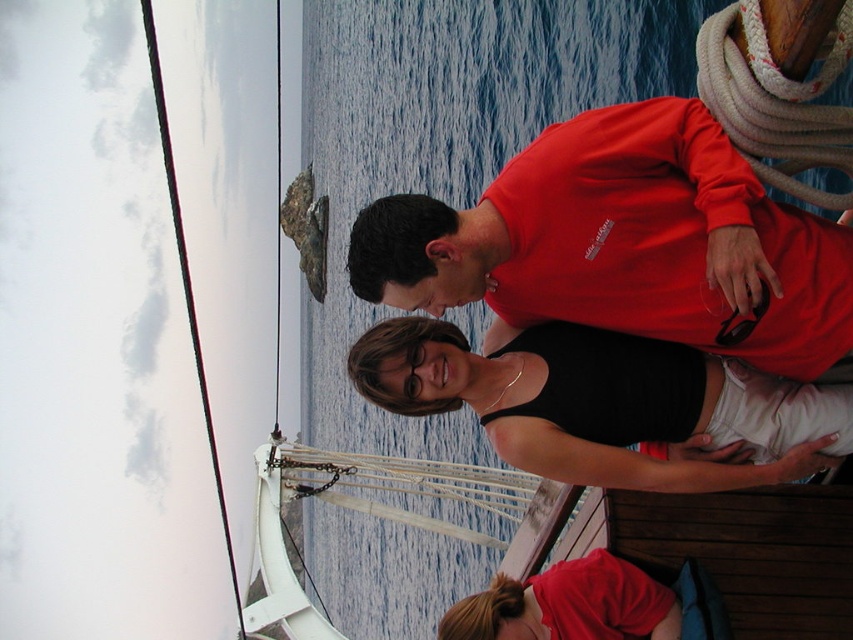
You are a photographer trying to capture the baby in white on the boat. The baby is partially hidden by the man in the bright red shirt. To ensure the baby is fully visible in your photo, should you adjust your camera to focus on the point marked by the coordinates point [625,243]?

The matte red shirt at center is represented by point [625,243]. Therefore, focusing on this point would center the red shirt, which is obscuring the baby, so you should adjust your focus away from this point to capture the baby in white more clearly.

You are a photographer trying to capture the perfect shot of the two people on the boat. You want to ensure that the matte red shirt at center and the black matte tank top at center are both clearly visible in the frame. Based on their positions, which one is closer to the right edge of the photo?

The matte red shirt at center is positioned to the right of the black matte tank top at center, so the matte red shirt at center is closer to the right edge of the photo.

You are a photographer on a boat and want to ensure that both the matte red shirt at center and the black matte tank top at center are in focus. Your camera has a depth of field that can cover 10 feet. Can both subjects be in focus simultaneously?

The matte red shirt at center and black matte tank top at center are 9.32 feet apart. Since the camera can cover 10 feet, both subjects can be in focus simultaneously.